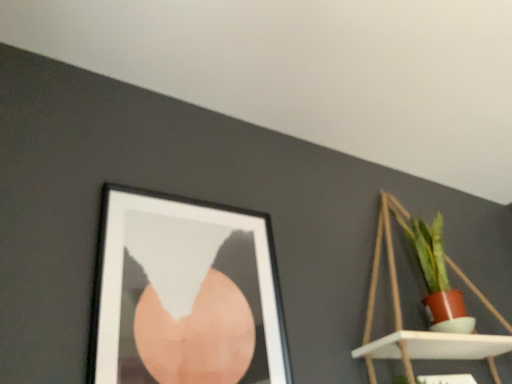
Question: Looking at their shapes, would you say black matte picture frame at upper left is wider or thinner than matte wooden shelf at upper right?

Choices:
 (A) thin
 (B) wide

Answer: (A)

Question: Based on their sizes in the image, would you say black matte picture frame at upper left is bigger or smaller than matte wooden shelf at upper right?

Choices:
 (A) small
 (B) big

Answer: (A)

Question: From the image's perspective, is black matte picture frame at upper left above or below matte wooden shelf at upper right?

Choices:
 (A) above
 (B) below

Answer: (A)

Question: From the image's perspective, is matte wooden shelf at upper right located above or below black matte picture frame at upper left?

Choices:
 (A) above
 (B) below

Answer: (B)

Question: Is matte wooden shelf at upper right inside or outside of black matte picture frame at upper left?

Choices:
 (A) outside
 (B) inside

Answer: (A)

Question: Is point (395, 324) positioned closer to the camera than point (232, 327)?

Choices:
 (A) farther
 (B) closer

Answer: (A)

Question: Considering the relative positions of matte wooden shelf at upper right and black matte picture frame at upper left in the image provided, is matte wooden shelf at upper right to the left or to the right of black matte picture frame at upper left?

Choices:
 (A) right
 (B) left

Answer: (A)